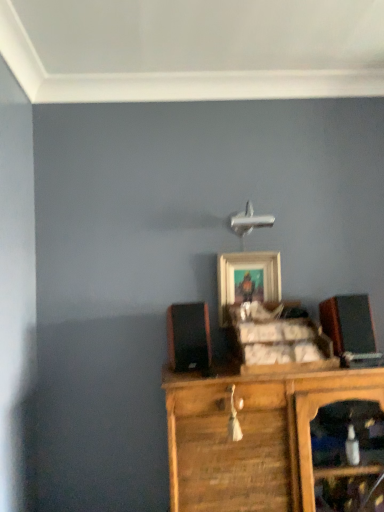
Question: Is wooden cabinet at center to the left of black matte speaker at left, acting as the second speaker starting from the right, from the viewer's perspective?

Choices:
 (A) no
 (B) yes

Answer: (A)

Question: Is wooden cabinet at center facing away from black matte speaker at left, acting as the second speaker starting from the right?

Choices:
 (A) yes
 (B) no

Answer: (B)

Question: Can you confirm if wooden cabinet at center is bigger than black matte speaker at left, acting as the second speaker starting from the right?

Choices:
 (A) no
 (B) yes

Answer: (B)

Question: From a real-world perspective, is wooden cabinet at center below black matte speaker at left, acting as the second speaker starting from the right?

Choices:
 (A) no
 (B) yes

Answer: (B)

Question: From the image's perspective, is wooden cabinet at center above black matte speaker at left, acting as the second speaker starting from the right?

Choices:
 (A) no
 (B) yes

Answer: (A)

Question: From a real-world perspective, is black matte speaker at right, which is counted as the second speaker, starting from the left, above or below wooden cabinet at center?

Choices:
 (A) below
 (B) above

Answer: (B)

Question: Choose the correct answer: Is black matte speaker at right, which is counted as the second speaker, starting from the left, inside wooden cabinet at center or outside it?

Choices:
 (A) outside
 (B) inside

Answer: (A)

Question: In terms of size, does black matte speaker at right, which is counted as the 1th speaker, starting from the right, appear bigger or smaller than wooden cabinet at center?

Choices:
 (A) small
 (B) big

Answer: (A)

Question: Is black matte speaker at right, which is counted as the second speaker, starting from the left, wider or thinner than wooden cabinet at center?

Choices:
 (A) wide
 (B) thin

Answer: (B)

Question: In terms of height, does wooden framed picture at center look taller or shorter compared to wooden cabinet at center?

Choices:
 (A) short
 (B) tall

Answer: (A)

Question: Is point (246, 251) positioned closer to the camera than point (283, 498)?

Choices:
 (A) farther
 (B) closer

Answer: (A)

Question: Is wooden framed picture at center in front of or behind wooden cabinet at center in the image?

Choices:
 (A) front
 (B) behind

Answer: (B)

Question: Is wooden framed picture at center wider or thinner than wooden cabinet at center?

Choices:
 (A) wide
 (B) thin

Answer: (B)

Question: Considering the positions of point (178, 307) and point (264, 300), is point (178, 307) closer or farther from the camera than point (264, 300)?

Choices:
 (A) farther
 (B) closer

Answer: (B)

Question: Do you think black matte speaker at left, acting as the second speaker starting from the right, is within wooden framed picture at center, or outside of it?

Choices:
 (A) inside
 (B) outside

Answer: (B)